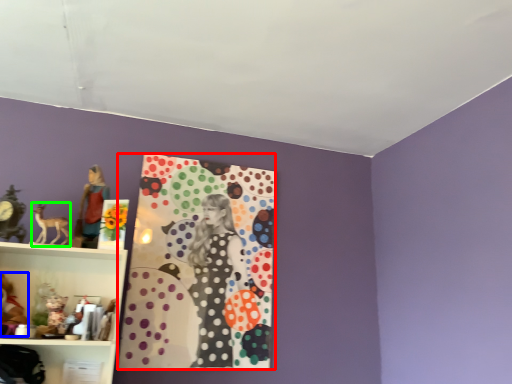
Question: Considering the real-world distances, which object is closest to design (highlighted by a red box)? toy (highlighted by a blue box) or animal (highlighted by a green box).

Choices:
 (A) toy
 (B) animal

Answer: (B)